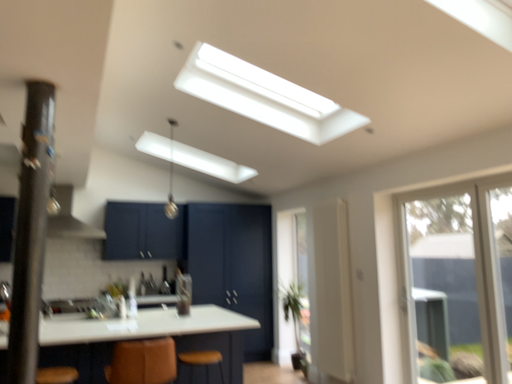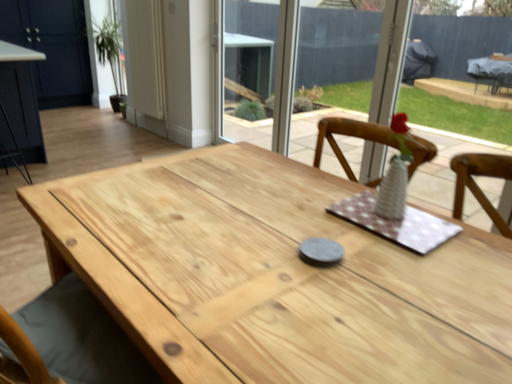
Question: Which way did the camera rotate in the video?

Choices:
 (A) rotated right
 (B) rotated left

Answer: (A)